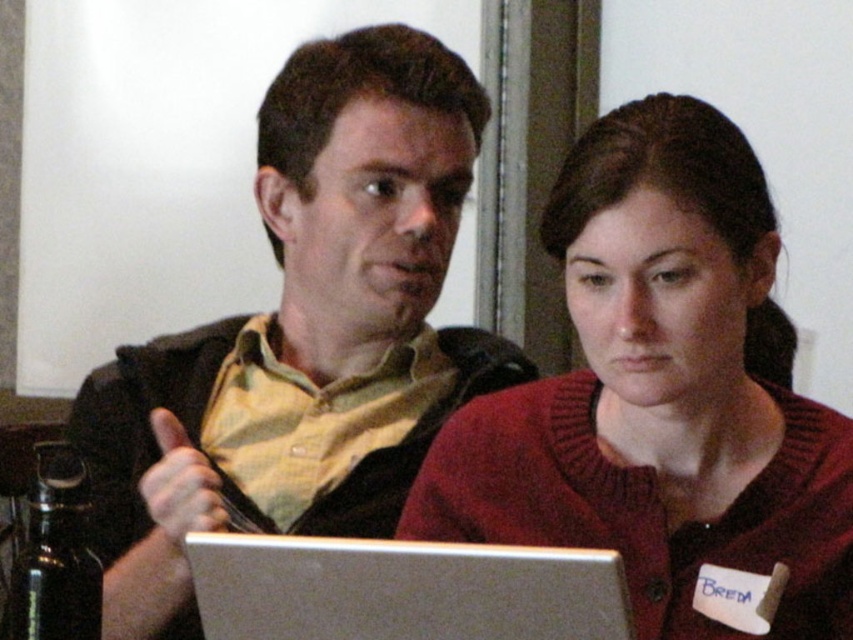
Question: Estimate the real-world distances between objects in this image. Which object is farther from the silver metallic laptop at center?

Choices:
 (A) matte black laptop at center
 (B) knitted red sweater at center

Answer: (A)

Question: Is matte black laptop at center above silver metallic laptop at center?

Choices:
 (A) yes
 (B) no

Answer: (A)

Question: Can you confirm if matte black laptop at center is smaller than knitted red sweater at center?

Choices:
 (A) no
 (B) yes

Answer: (A)

Question: Among these points, which one is nearest to the camera?

Choices:
 (A) (840, 604)
 (B) (479, 88)

Answer: (A)

Question: Is knitted red sweater at center to the right of silver metallic laptop at center from the viewer's perspective?

Choices:
 (A) yes
 (B) no

Answer: (A)

Question: Which point appears farthest from the camera in this image?

Choices:
 (A) (817, 444)
 (B) (354, 621)
 (C) (91, 451)

Answer: (C)